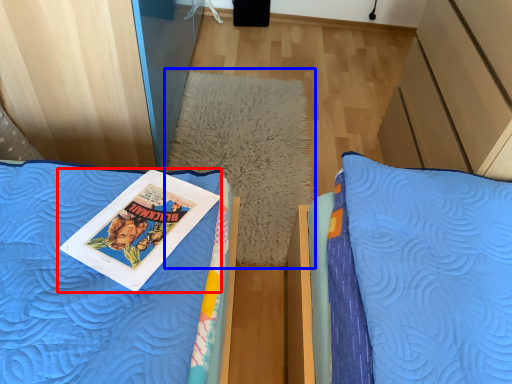
Question: Which point is further to the camera, book (highlighted by a red box) or pillow (highlighted by a blue box)?

Choices:
 (A) book
 (B) pillow

Answer: (B)